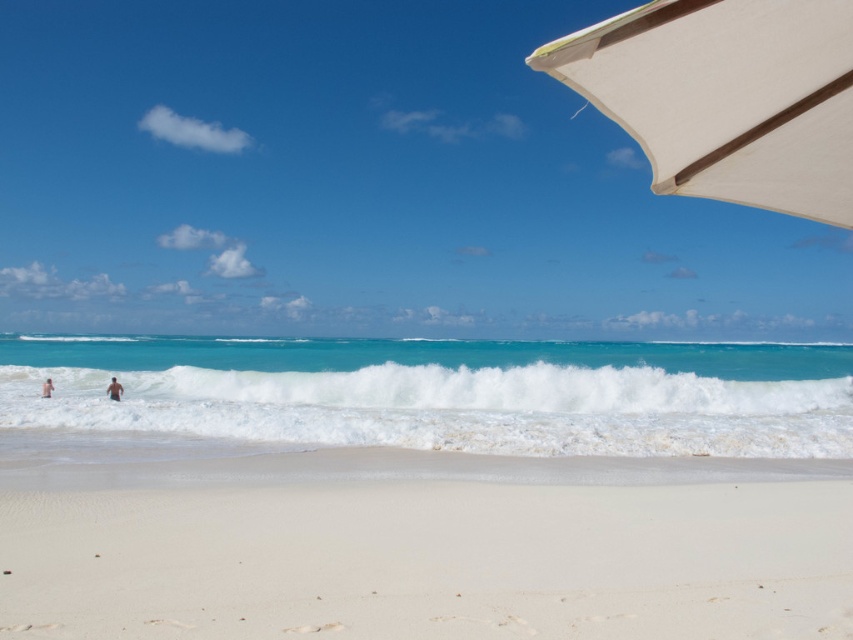
Question: From the image, what is the correct spatial relationship of white fabric umbrella at upper right in relation to blurred skin person at lower left?

Choices:
 (A) below
 (B) above

Answer: (B)

Question: Estimate the real-world distances between objects in this image. Which object is farther from the blurred skin person at lower left?

Choices:
 (A) white sandy beach at lower center
 (B) white fabric umbrella at upper right

Answer: (B)

Question: Is white fabric umbrella at upper right thinner than blurred skin person at lower left?

Choices:
 (A) no
 (B) yes

Answer: (A)

Question: Among these objects, which one is farthest from the camera?

Choices:
 (A) skinny man at left
 (B) white foamy wave at center

Answer: (A)

Question: Does white fabric umbrella at upper right have a smaller size compared to skinny man at left?

Choices:
 (A) no
 (B) yes

Answer: (A)

Question: Among these objects, which one is farthest from the camera?

Choices:
 (A) white foamy wave at center
 (B) skinny man at left

Answer: (B)